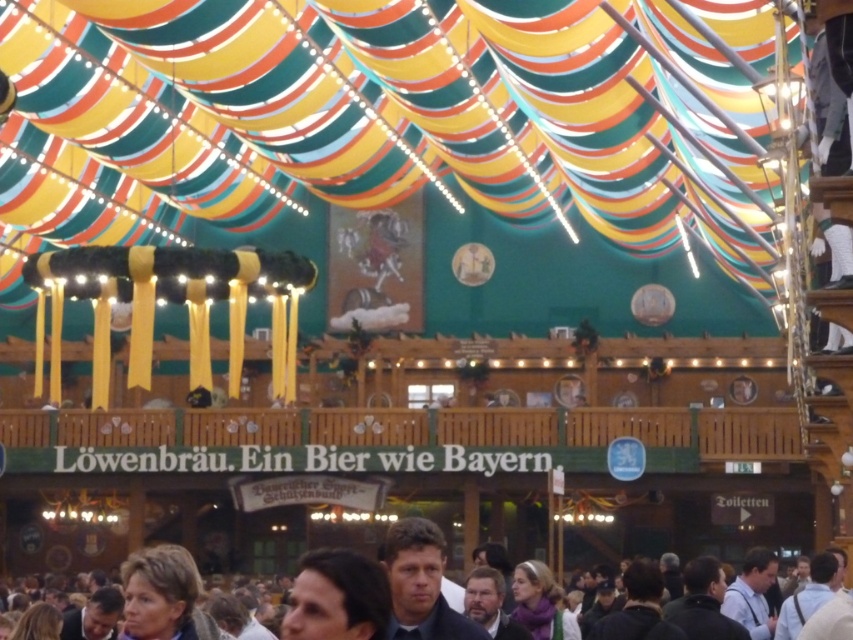
Question: Does dark brown hair at center have a larger size compared to smooth brown hair at lower left?

Choices:
 (A) no
 (B) yes

Answer: (A)

Question: Estimate the real-world distances between objects in this image. Which object is closer to the light brown leather jacket at lower right?

Choices:
 (A) blue denim shirt at center
 (B) smooth brown hair at lower left
 (C) smooth black suit at lower left

Answer: (A)

Question: Can you confirm if light blue shirt at lower right is positioned to the left of light brown leather jacket at lower right?

Choices:
 (A) yes
 (B) no

Answer: (A)

Question: Among these points, which one is nearest to the camera?

Choices:
 (A) click(x=108, y=624)
 (B) click(x=178, y=608)
 (C) click(x=762, y=577)

Answer: (B)

Question: Estimate the real-world distances between objects in this image. Which object is farther from the dark gray jacket at lower right?

Choices:
 (A) light brown leather jacket at lower right
 (B) blue denim shirt at center
 (C) bearded man at center
 (D) dark brown hair at center

Answer: (D)

Question: Considering the relative positions of dark brown hair at center and smooth brown hair at lower left in the image provided, where is dark brown hair at center located with respect to smooth brown hair at lower left?

Choices:
 (A) right
 (B) left

Answer: (A)